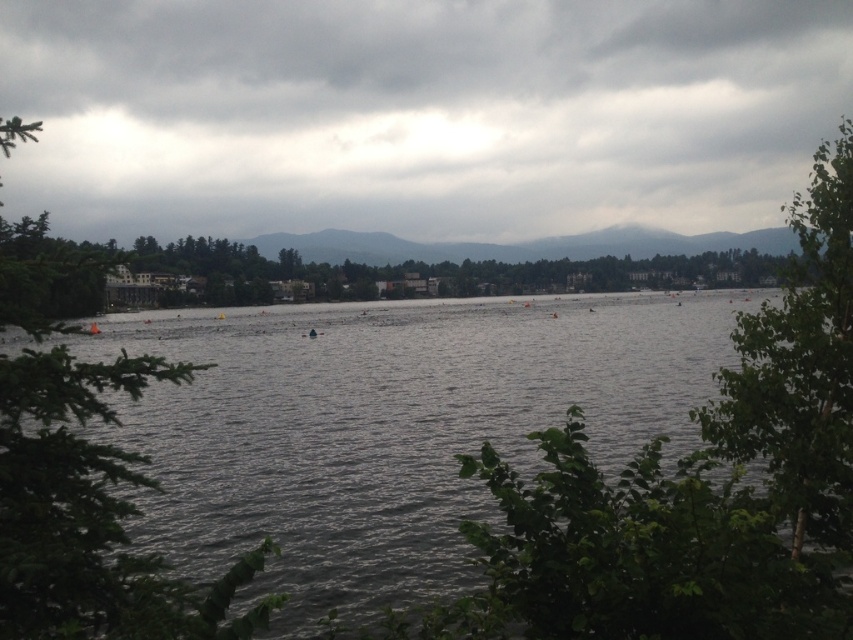
In the scene shown: You are a bird flying over the lakeside scene. You want to land on the tallest tree to rest. Which tree should you choose between the green leafy tree at left and the green leafy tree at right?

The green leafy tree at right is taller than the green leafy tree at left, so you should choose the green leafy tree at right to land on.

You are standing at the lakeside and looking towards the point marked as point (419,113). What do you see in that direction?

You see the cloudy sky at upper center in the direction of point (419,113).

You are standing in the middle of the lakeside scene and see the green leafy tree at left and the green leafy tree at right. Which tree is positioned more to your left side?

The green leafy tree at left is positioned more to your left side than the green leafy tree at right.